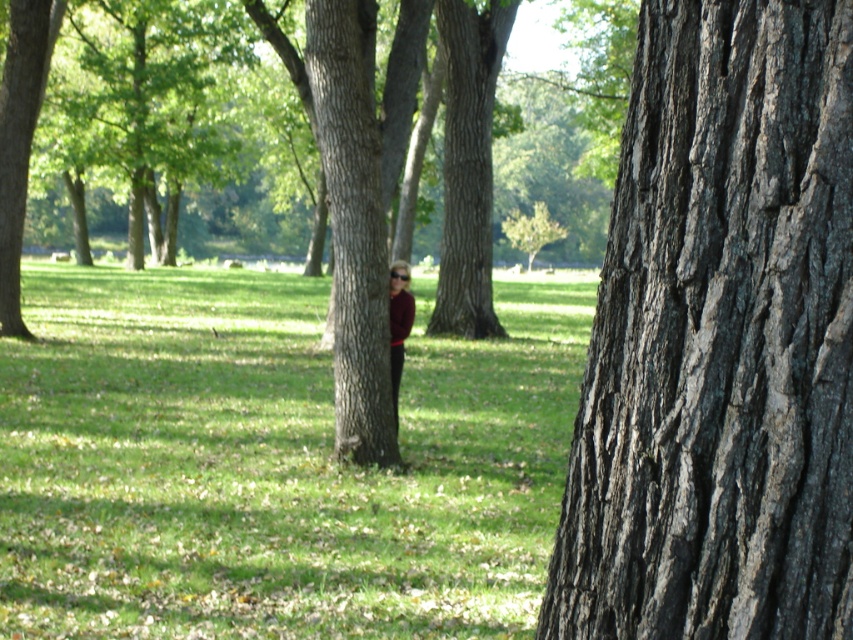
From the picture: Is brown rough tree trunk at center smaller than maroon shirt at center?

No.

The width and height of the screenshot is (853, 640). What do you see at coordinates (352, 232) in the screenshot?
I see `brown rough tree trunk at center` at bounding box center [352, 232].

Identify the location of brown rough tree trunk at center. (352, 232).

Does green grass at center have a greater width compared to maroon shirt at center?

Correct, the width of green grass at center exceeds that of maroon shirt at center.

Can you confirm if green grass at center is positioned below maroon shirt at center?

Yes, green grass at center is below maroon shirt at center.

Who is more distant from viewer, [372,470] or [389,362]?

Point [389,362]

Locate an element on the screen. The height and width of the screenshot is (640, 853). green grass at center is located at coordinates (271, 464).

Can you confirm if green grass at center is positioned below brown rough tree trunk at center?

Yes.

Where is `green grass at center`? Image resolution: width=853 pixels, height=640 pixels. green grass at center is located at coordinates (271, 464).

The image size is (853, 640). Find the location of `green grass at center`. green grass at center is located at coordinates (271, 464).